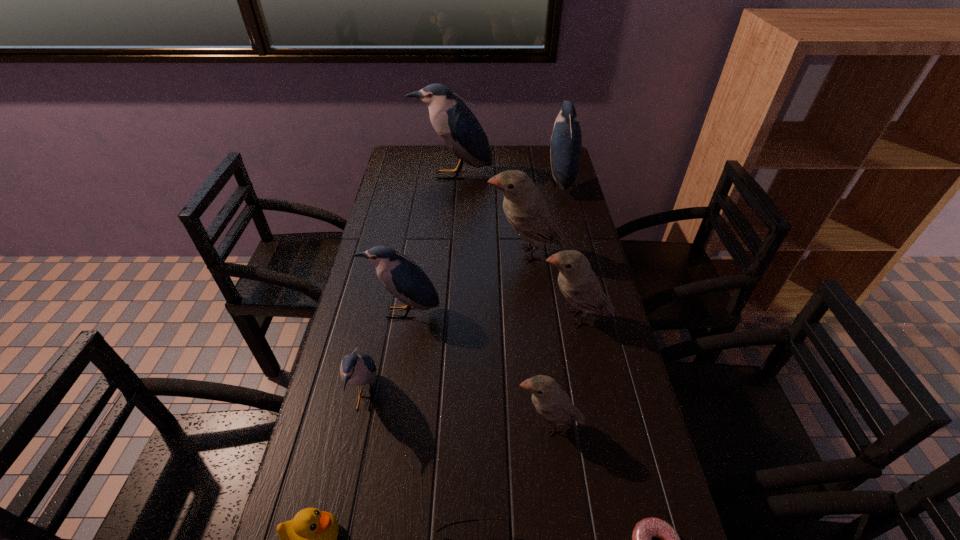
Image resolution: width=960 pixels, height=540 pixels. What are the coordinates of `blank space located 0.210m at the tip of the nearest blue bird's beak` in the screenshot? It's located at (467, 399).

Locate an element on the screen. The height and width of the screenshot is (540, 960). vacant point located at the face of the nearest white bird is located at coordinates (387, 424).

I want to click on vacant space situated at the face of the nearest white bird, so click(409, 424).

You are a GUI agent. You are given a task and a screenshot of the screen. Output one action in this format:
    pyautogui.click(x=<x>, y=<y>)
    Task: Click on the vacant space located 0.200m at the face of the nearest white bird
    The width and height of the screenshot is (960, 540).
    Given the screenshot: What is the action you would take?
    pyautogui.click(x=427, y=424)

You are a GUI agent. You are given a task and a screenshot of the screen. Output one action in this format:
    pyautogui.click(x=<x>, y=<y>)
    Task: Click on the object at the far left corner
    This screenshot has width=960, height=540.
    Given the screenshot: What is the action you would take?
    pyautogui.click(x=457, y=126)

Locate an element on the screen. object located in the far right corner section of the desktop is located at coordinates (566, 140).

Where is `vacant space at the far edge of the desktop`? The width and height of the screenshot is (960, 540). vacant space at the far edge of the desktop is located at coordinates (527, 172).

I want to click on vacant space at the left edge of the desktop, so click(342, 353).

Image resolution: width=960 pixels, height=540 pixels. In the image, there is a desktop. In order to click on vacant space at the right edge in this screenshot , I will do `click(609, 403)`.

I want to click on vacant area at the far left corner, so click(x=420, y=159).